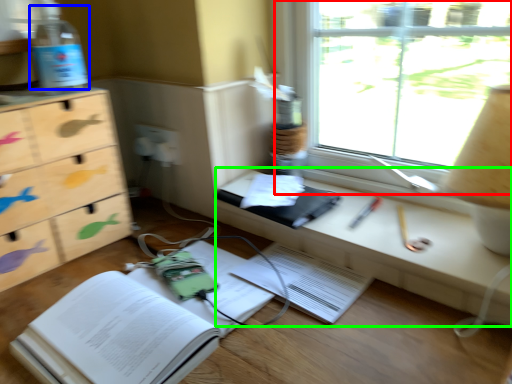
Question: Estimate the real-world distances between objects in this image. Which object is farther from window (highlighted by a red box), bottle (highlighted by a blue box) or computer desk (highlighted by a green box)?

Choices:
 (A) bottle
 (B) computer desk

Answer: (A)